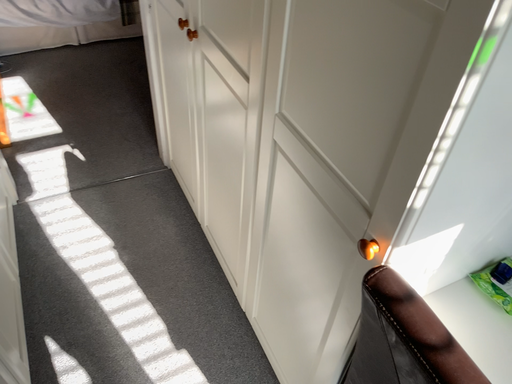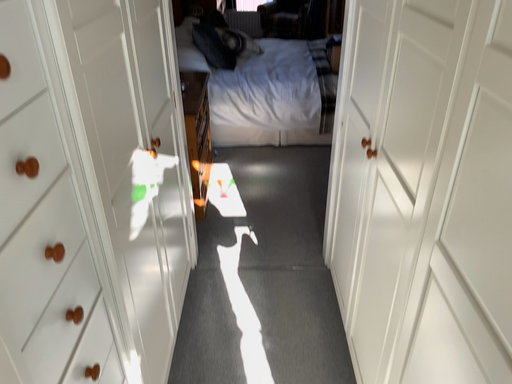
Question: Which way did the camera rotate in the video?

Choices:
 (A) rotated left
 (B) rotated right

Answer: (A)